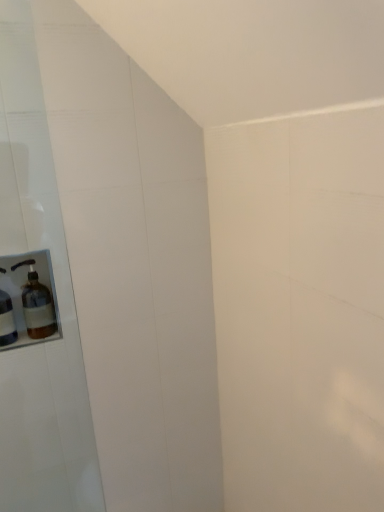
Question: In the image, is translucent glass soap dispenser at left, arranged as the 2th bottle when viewed from the right, positioned in front of or behind brown glass bottle at left, the 2th bottle positioned from the left?

Choices:
 (A) front
 (B) behind

Answer: (A)

Question: Based on their sizes in the image, would you say translucent glass soap dispenser at left, arranged as the 2th bottle when viewed from the right, is bigger or smaller than brown glass bottle at left, the 2th bottle positioned from the left?

Choices:
 (A) small
 (B) big

Answer: (A)

Question: Do you think translucent glass soap dispenser at left, arranged as the 2th bottle when viewed from the right, is within brown glass bottle at left, the 2th bottle positioned from the left, or outside of it?

Choices:
 (A) outside
 (B) inside

Answer: (A)

Question: From the image's perspective, is brown glass bottle at left, which appears as the 1th bottle when viewed from the right, positioned above or below translucent glass soap dispenser at left, the first bottle from the left?

Choices:
 (A) below
 (B) above

Answer: (B)

Question: Would you say brown glass bottle at left, the 2th bottle positioned from the left, is to the left or to the right of translucent glass soap dispenser at left, arranged as the 2th bottle when viewed from the right, in the picture?

Choices:
 (A) left
 (B) right

Answer: (B)

Question: Is point (48, 296) positioned closer to the camera than point (3, 345)?

Choices:
 (A) farther
 (B) closer

Answer: (A)

Question: Which is correct: brown glass bottle at left, which appears as the 1th bottle when viewed from the right, is inside translucent glass soap dispenser at left, arranged as the 2th bottle when viewed from the right, or outside of it?

Choices:
 (A) inside
 (B) outside

Answer: (B)